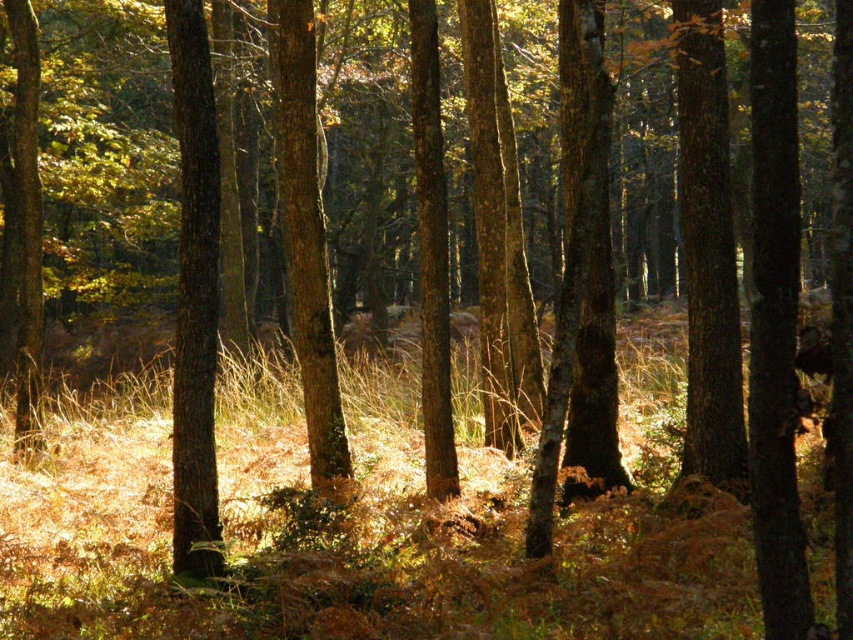
You are a hiker trying to identify the largest tree in this forest scene. Which tree should you choose between the smooth brown tree trunk at right and the smooth bark tree at center?

The smooth brown tree trunk at right is bigger than the smooth bark tree at center, so you should choose the smooth brown tree trunk at right as the largest tree.

You are standing in the forest scene and want to locate the smooth brown tree trunk at right. According to the coordinates provided, where exactly would you find it?

The smooth brown tree trunk at right is located at point 0.400 in the x coordinate and 0.830 in the y coordinate.

You are standing in the forest described in the scene. There is a point marked at coordinates (358, 528). What is located at this point?

The point at coordinates (358, 528) is where the brown dry grass at center is located.